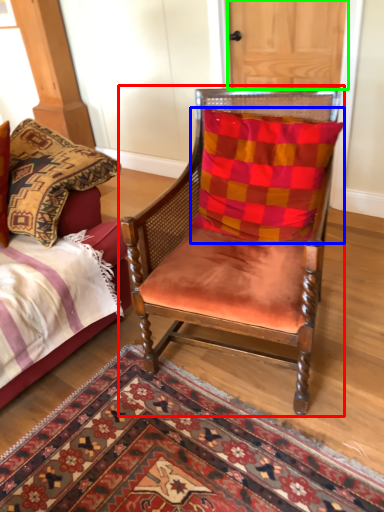
Question: Considering the real-world distances, which object is farthest from chair (highlighted by a red box)? pillow (highlighted by a blue box) or door (highlighted by a green box)?

Choices:
 (A) pillow
 (B) door

Answer: (B)